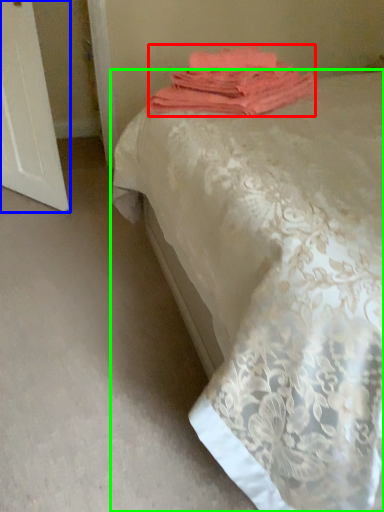
Question: Which is nearer to the towel (highlighted by a red box)? screen door (highlighted by a blue box) or bed (highlighted by a green box).

Choices:
 (A) screen door
 (B) bed

Answer: (B)